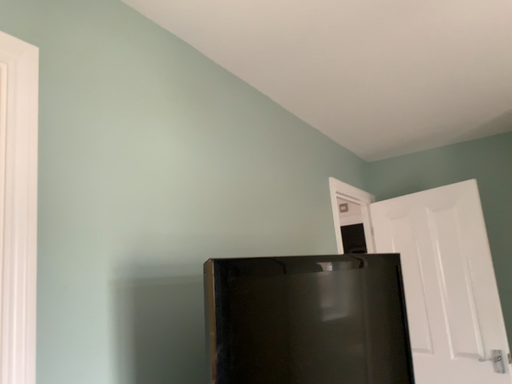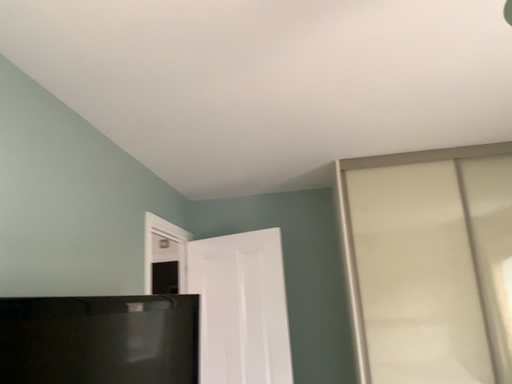
Question: Which way did the camera rotate in the video?

Choices:
 (A) rotated left
 (B) rotated right

Answer: (B)